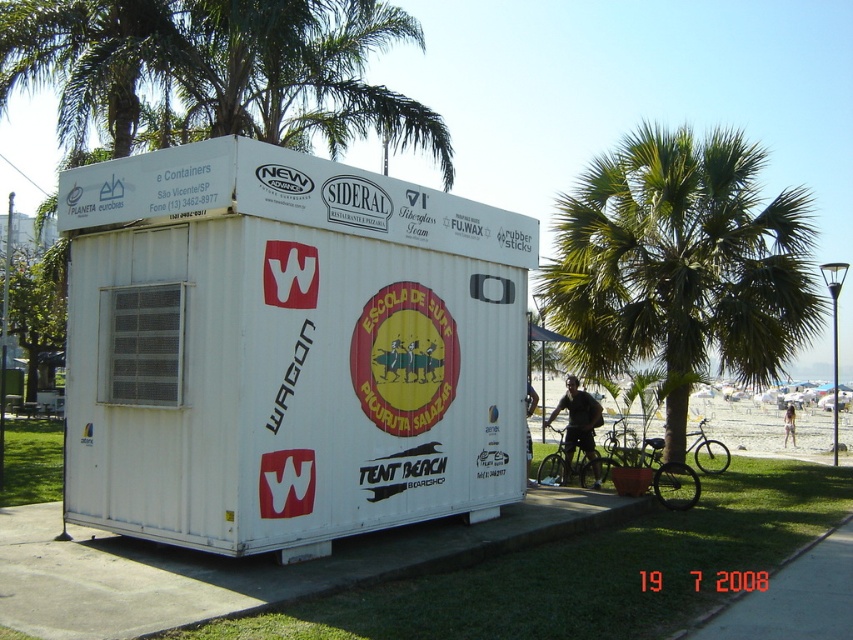
Question: Which point is farther to the camera?

Choices:
 (A) (668, 497)
 (B) (677, 416)
 (C) (573, 406)
 (D) (267, 348)

Answer: (B)

Question: Which is nearer to the metallic silver bicycle at lower center?

Choices:
 (A) white matte shipping container at center
 (B) green leafy palm tree at center
 (C) dark brown leather jacket at center

Answer: (C)

Question: Which point appears farthest from the camera in this image?

Choices:
 (A) (659, 442)
 (B) (660, 336)
 (C) (155, 465)
 (D) (577, 392)

Answer: (B)

Question: Does white matte shipping container at center have a larger size compared to dark brown leather jacket at center?

Choices:
 (A) yes
 (B) no

Answer: (A)

Question: Does white matte shipping container at center appear under metallic silver bicycle at lower center?

Choices:
 (A) no
 (B) yes

Answer: (A)

Question: Is green leafy palm tree at center in front of dark brown leather jacket at center?

Choices:
 (A) no
 (B) yes

Answer: (A)